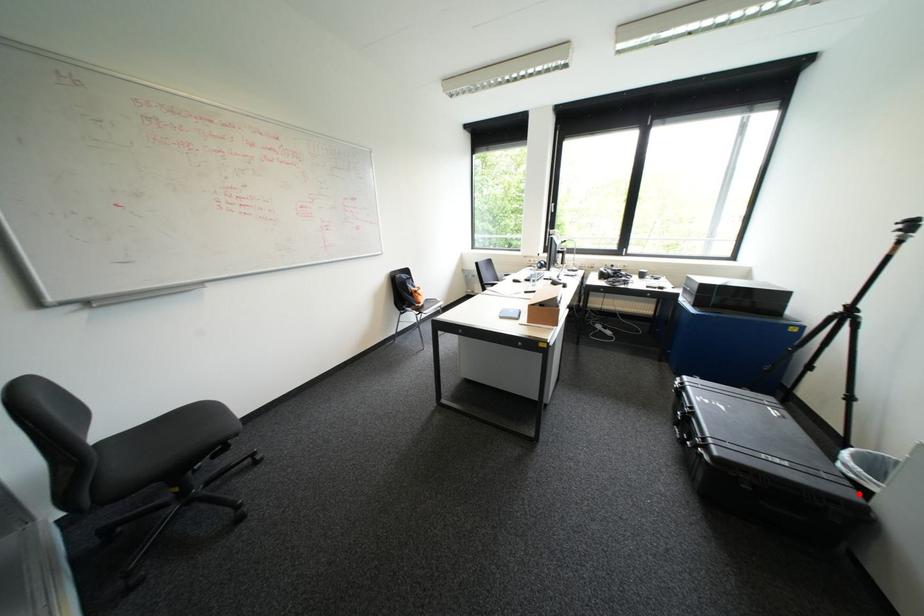
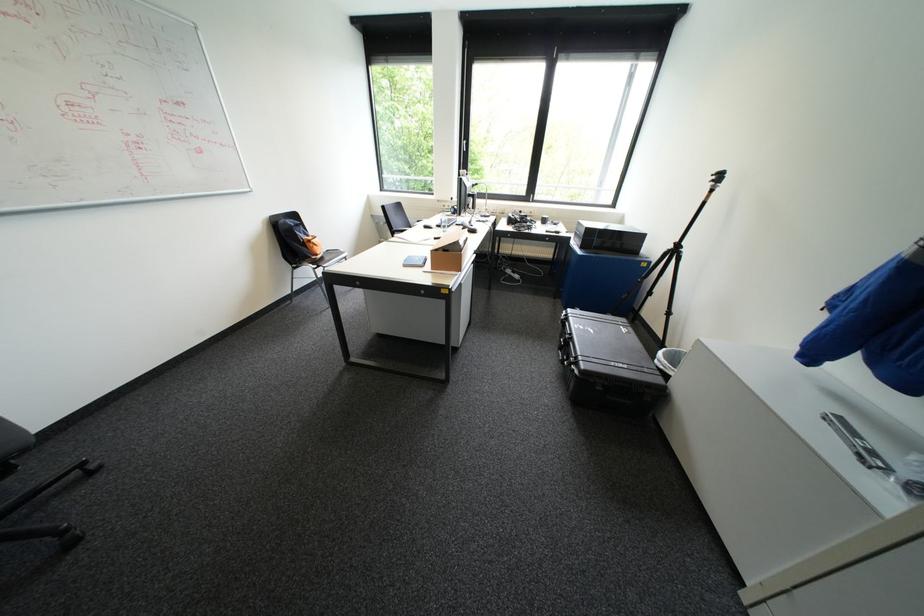
Question: I am providing you with two images of the same scene from different viewpoints. A red point is shown in image1. For the corresponding object point in image2, is it positioned nearer or farther from the camera?

Choices:
 (A) Nearer
 (B) Farther

Answer: (B)